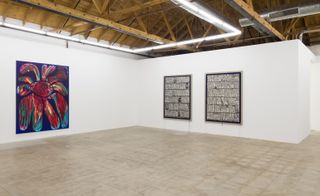
Find the location of a particular element. white walls is located at coordinates (105, 92), (137, 99), (282, 86), (313, 88), (9, 94), (27, 45).